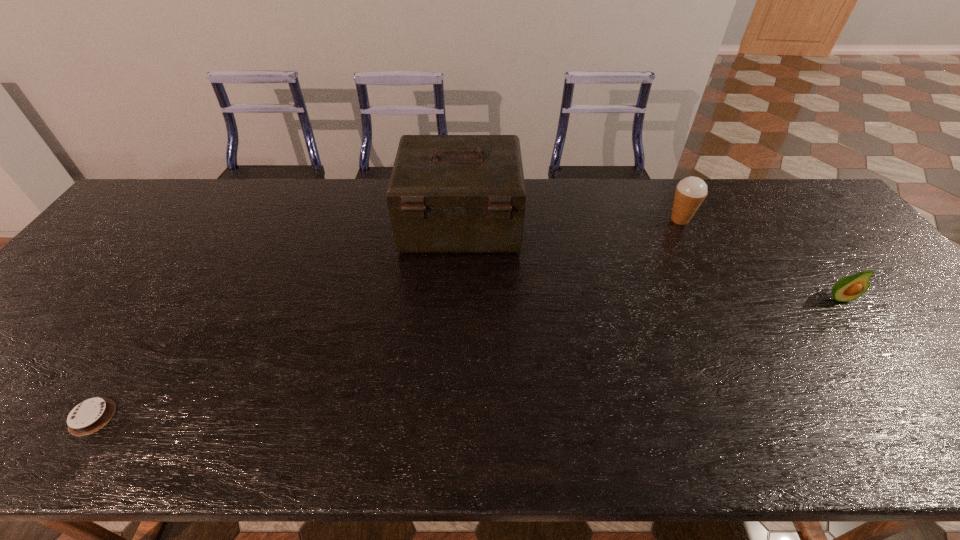
Image resolution: width=960 pixels, height=540 pixels. What are the coordinates of `blank space located on the cut side of the third tallest object` in the screenshot? It's located at (926, 415).

This screenshot has width=960, height=540. Find the location of `free region located on the left of the leftmost object`. free region located on the left of the leftmost object is located at coordinates (38, 417).

The width and height of the screenshot is (960, 540). Find the location of `the first-aid kit situated at the far edge`. the first-aid kit situated at the far edge is located at coordinates (447, 193).

Find the location of a particular element. The image size is (960, 540). icecream positioned at the far edge is located at coordinates (690, 192).

At what (x,y) coordinates should I click in order to perform the action: click on object that is positioned at the near edge. Please return your answer as a coordinate pair (x, y). Looking at the image, I should click on (x=89, y=416).

Find the location of a particular element. object that is at the right edge is located at coordinates (849, 288).

I want to click on free region at the far edge, so click(x=588, y=207).

In the image, there is a desktop. Where is `free space at the near edge`? The width and height of the screenshot is (960, 540). free space at the near edge is located at coordinates (529, 440).

The image size is (960, 540). In order to click on vacant space at the left edge of the desktop in this screenshot , I will do [67, 298].

You are a GUI agent. You are given a task and a screenshot of the screen. Output one action in this format:
    pyautogui.click(x=<x>, y=<y>)
    Task: Click on the vacant space at the far left corner of the desktop
    
    Given the screenshot: What is the action you would take?
    pyautogui.click(x=178, y=187)